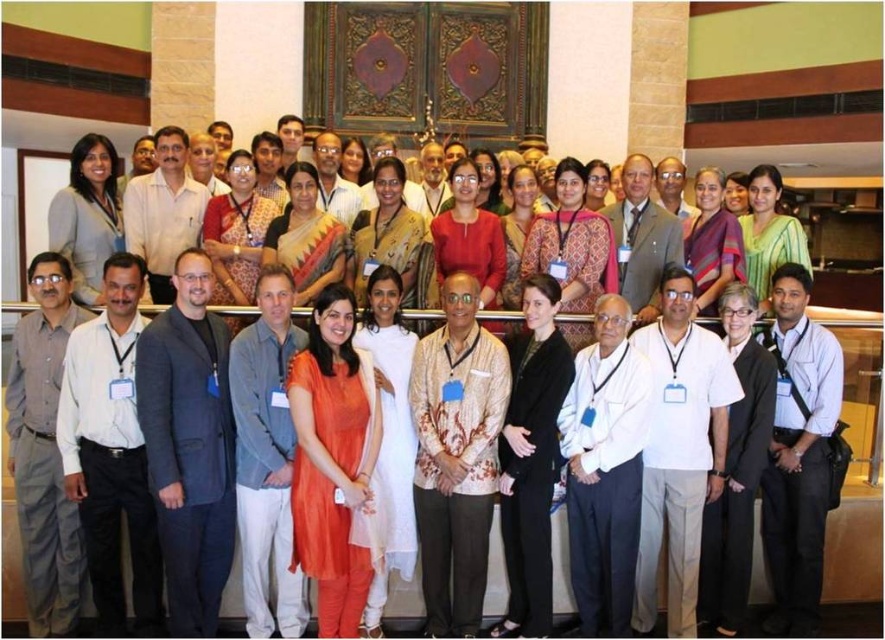
At what (x,y) coordinates should I click in order to perform the action: click on patterned beige shirt at center. Please return your answer as a coordinate pair (x, y). The height and width of the screenshot is (640, 885). Looking at the image, I should click on (456, 456).

Where is `patterned beige shirt at center`? This screenshot has width=885, height=640. patterned beige shirt at center is located at coordinates (456, 456).

This screenshot has height=640, width=885. I want to click on patterned beige shirt at center, so pyautogui.click(x=456, y=456).

Between white shirt at left and white cotton shirt at center, which one is positioned higher?

white shirt at left is above.

Locate an element on the screen. The width and height of the screenshot is (885, 640). white shirt at left is located at coordinates (112, 452).

Can you confirm if gray cotton shirt at left is wider than light brown textured shirt at center?

Correct, the width of gray cotton shirt at left exceeds that of light brown textured shirt at center.

Does point (70, 516) come farther from viewer compared to point (639, 154)?

No.

The image size is (885, 640). What do you see at coordinates (44, 451) in the screenshot?
I see `gray cotton shirt at left` at bounding box center [44, 451].

Identify the location of gray cotton shirt at left. (44, 451).